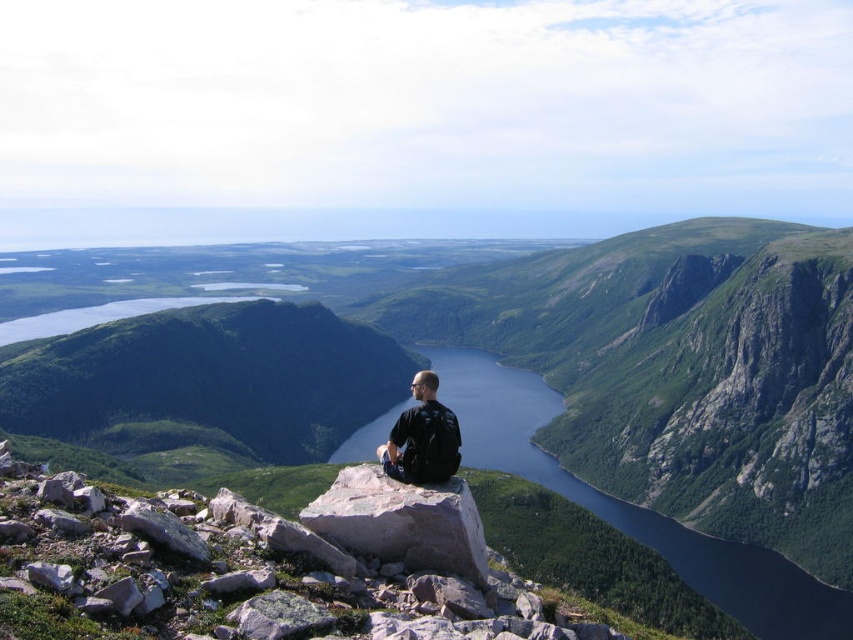
What do you see at coordinates (630, 502) in the screenshot? I see `blue glassy water at center` at bounding box center [630, 502].

Who is higher up, blue glassy water at center or black fabric backpack at center?

black fabric backpack at center is higher up.

What do you see at coordinates (630, 502) in the screenshot?
I see `blue glassy water at center` at bounding box center [630, 502].

Identify the location of blue glassy water at center. This screenshot has width=853, height=640. [630, 502].

How much distance is there between green rocky mountain at center and gray rock at center?

green rocky mountain at center is 385.00 meters from gray rock at center.

Does green rocky mountain at center have a lesser height compared to gray rock at center?

Incorrect, green rocky mountain at center's height does not fall short of gray rock at center's.

Does point (299, 284) come behind point (416, 484)?

That is True.

Identify the location of green rocky mountain at center. (598, 378).

Which is below, green rocky mountain at center or black fabric backpack at center?

black fabric backpack at center is below.

Which is behind, point (636, 460) or point (376, 456)?

The point (636, 460) is more distant.

Find the location of a particular element. green rocky mountain at center is located at coordinates (598, 378).

Where is `green rocky mountain at center`? This screenshot has width=853, height=640. green rocky mountain at center is located at coordinates (598, 378).